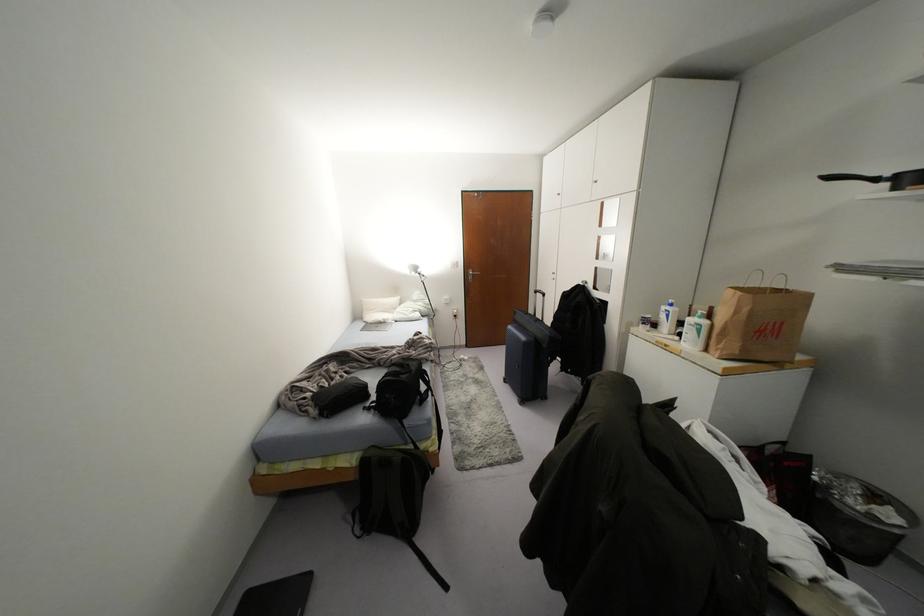
In order to click on suitcase handle in this screenshot , I will do `click(538, 296)`.